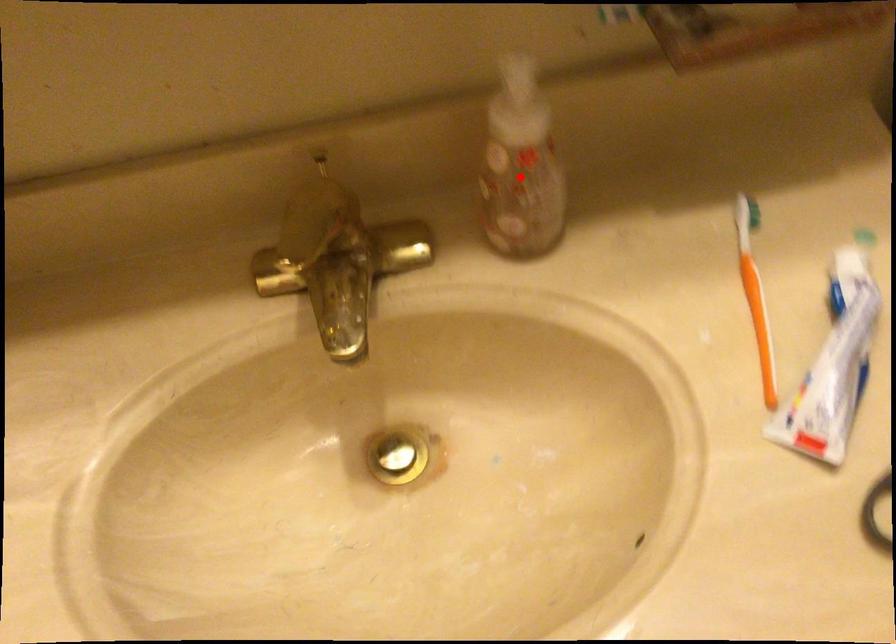
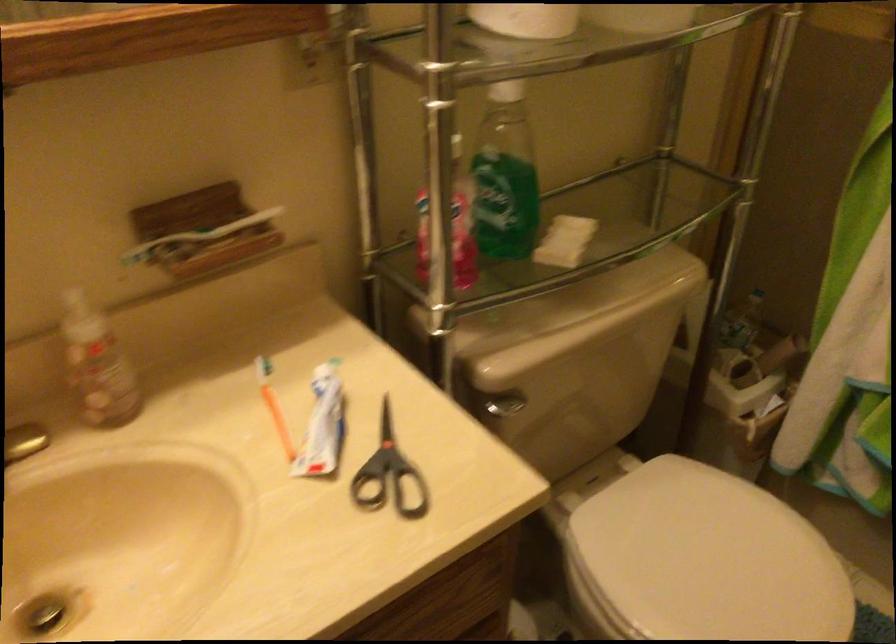
Where in the second image is the point corresponding to the highlighted location from the first image?

(97, 364)